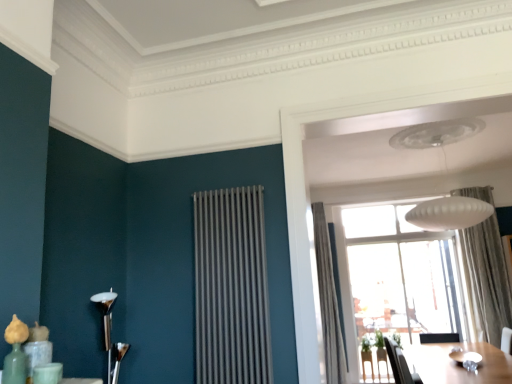
Where is `polished silver candlestick at left, the first lamp when ordered from bottom to top`? The width and height of the screenshot is (512, 384). polished silver candlestick at left, the first lamp when ordered from bottom to top is located at coordinates (110, 334).

What do you see at coordinates (110, 334) in the screenshot? I see `polished silver candlestick at left, the first lamp when ordered from bottom to top` at bounding box center [110, 334].

In order to face white matte lampshade at upper center, arranged as the second lamp when ordered from the bottom, should I rotate leftwards or rightwards?

To align with it, rotate right about 23.623°.

Describe the element at coordinates (231, 288) in the screenshot. I see `satin silver radiator at center` at that location.

The height and width of the screenshot is (384, 512). What do you see at coordinates (328, 301) in the screenshot?
I see `gray textured curtain at upper right, positioned as the 1th curtain in left-to-right order` at bounding box center [328, 301].

Looking at this image, what is the approximate width of gray textured curtain at upper right, positioned as the second curtain in right-to-left order?

gray textured curtain at upper right, positioned as the second curtain in right-to-left order, is 20.97 inches in width.

This screenshot has width=512, height=384. I want to click on polished silver candlestick at left, which is the 2th lamp in top-to-bottom order, so click(x=110, y=334).

Consider the image. Considering the relative sizes of white textured curtain at upper right, the first curtain positioned from the right, and transparent glass window at center in the image provided, is white textured curtain at upper right, the first curtain positioned from the right, thinner than transparent glass window at center?

No.

From the image's perspective, does white textured curtain at upper right, the first curtain positioned from the right, appear higher than transparent glass window at center?

Yes.

Is white textured curtain at upper right, arranged as the second curtain when viewed from the left, positioned far away from transparent glass window at center?

white textured curtain at upper right, arranged as the second curtain when viewed from the left, is actually quite close to transparent glass window at center.

How many degrees apart are the facing directions of white textured curtain at upper right, the first curtain positioned from the right, and transparent glass window at center?

The angle between the facing direction of white textured curtain at upper right, the first curtain positioned from the right, and the facing direction of transparent glass window at center is 4.69 degrees.

Considering the sizes of objects black leather swivel chair at lower right and satin silver radiator at center in the image provided, who is wider, black leather swivel chair at lower right or satin silver radiator at center?

black leather swivel chair at lower right.

Considering the relative sizes of black leather swivel chair at lower right and satin silver radiator at center in the image provided, is black leather swivel chair at lower right smaller than satin silver radiator at center?

Incorrect, black leather swivel chair at lower right is not smaller in size than satin silver radiator at center.

Would you say black leather swivel chair at lower right is a long distance from satin silver radiator at center?

black leather swivel chair at lower right is positioned a significant distance from satin silver radiator at center.

The image size is (512, 384). In order to click on lamp behind the polished silver candlestick at left, marked as the 1th lamp in a left-to-right arrangement in this screenshot , I will do `click(449, 213)`.

From the image's perspective, is white matte lampshade at upper center, the 1th lamp from the top, on top of polished silver candlestick at left, marked as the 1th lamp in a left-to-right arrangement?

Correct, white matte lampshade at upper center, the 1th lamp from the top, appears higher than polished silver candlestick at left, marked as the 1th lamp in a left-to-right arrangement, in the image.

Could you tell me if white matte lampshade at upper center, positioned as the first lamp in right-to-left order, is turned towards polished silver candlestick at left, acting as the second lamp starting from the back?

No, white matte lampshade at upper center, positioned as the first lamp in right-to-left order, is not oriented towards polished silver candlestick at left, acting as the second lamp starting from the back.

Which is behind, point (457, 208) or point (99, 305)?

The point (457, 208) is behind.

From the image's perspective, who appears lower, white textured curtain at upper right, the first curtain positioned from the right, or black leather swivel chair at lower right?

black leather swivel chair at lower right, from the image's perspective.

The height and width of the screenshot is (384, 512). What are the coordinates of `the 2nd curtain located above the black leather swivel chair at lower right (from a real-world perspective)` in the screenshot? It's located at (487, 277).

Can you tell me how much white textured curtain at upper right, arranged as the second curtain when viewed from the left, and black leather swivel chair at lower right differ in facing direction?

The angular difference between white textured curtain at upper right, arranged as the second curtain when viewed from the left, and black leather swivel chair at lower right is 95.1 degrees.

From the picture: Which is more to the left, white textured curtain at upper right, arranged as the second curtain when viewed from the left, or black leather swivel chair at lower right?

black leather swivel chair at lower right.

Between transparent glass window at center and white matte lampshade at upper center, the 1th lamp from the top, which one has smaller size?

white matte lampshade at upper center, the 1th lamp from the top.

From a real-world perspective, is transparent glass window at center physically below white matte lampshade at upper center, acting as the 1th lamp starting from the back?

Correct, in the physical world, transparent glass window at center is lower than white matte lampshade at upper center, acting as the 1th lamp starting from the back.

Visually, is transparent glass window at center positioned to the left or to the right of white matte lampshade at upper center, the 2th lamp in the front-to-back sequence?

Based on their positions, transparent glass window at center is located to the right of white matte lampshade at upper center, the 2th lamp in the front-to-back sequence.

From the image's perspective, which is below, transparent glass window at center or white matte lampshade at upper center, arranged as the second lamp when ordered from the bottom?

transparent glass window at center.

Considering the relative sizes of white matte lampshade at upper center, the 2th lamp in the front-to-back sequence, and black leather swivel chair at lower right in the image provided, is white matte lampshade at upper center, the 2th lamp in the front-to-back sequence, taller than black leather swivel chair at lower right?

Correct, white matte lampshade at upper center, the 2th lamp in the front-to-back sequence, is much taller as black leather swivel chair at lower right.

Is white matte lampshade at upper center, the 2th lamp in the front-to-back sequence, at the right side of black leather swivel chair at lower right?

Indeed, white matte lampshade at upper center, the 2th lamp in the front-to-back sequence, is positioned on the right side of black leather swivel chair at lower right.

Does white matte lampshade at upper center, acting as the 1th lamp starting from the back, have a smaller size compared to black leather swivel chair at lower right?

No.

Is white matte lampshade at upper center, arranged as the second lamp when ordered from the bottom, further to the viewer compared to black leather swivel chair at lower right?

No, the depth of white matte lampshade at upper center, arranged as the second lamp when ordered from the bottom, is less than that of black leather swivel chair at lower right.

From the image's perspective, is white matte lampshade at upper center, the 2th lamp in the front-to-back sequence, above satin silver radiator at center?

Yes.

In terms of height, does white matte lampshade at upper center, acting as the 2th lamp starting from the left, look taller or shorter compared to satin silver radiator at center?

Clearly, white matte lampshade at upper center, acting as the 2th lamp starting from the left, is shorter compared to satin silver radiator at center.

Is white matte lampshade at upper center, positioned as the first lamp in right-to-left order, oriented away from satin silver radiator at center?

No, satin silver radiator at center is not at the back of white matte lampshade at upper center, positioned as the first lamp in right-to-left order.

At what (x,y) coordinates should I click in order to perform the action: click on curtain that is the 2nd one when counting upward from the transparent glass window at center (from the image's perspective). Please return your answer as a coordinate pair (x, y). The image size is (512, 384). Looking at the image, I should click on (487, 277).

I want to click on swivel chair behind the satin silver radiator at center, so click(400, 365).

When comparing their distances from black leather swivel chair at lower right, does satin silver radiator at center or gray textured curtain at upper right, positioned as the second curtain in right-to-left order, seem closer?

gray textured curtain at upper right, positioned as the second curtain in right-to-left order, is closer to black leather swivel chair at lower right.

Estimate the real-world distances between objects in this image. Which object is closer to satin silver radiator at center, gray textured curtain at upper right, positioned as the 1th curtain in left-to-right order, or wooden table at lower right?

Based on the image, gray textured curtain at upper right, positioned as the 1th curtain in left-to-right order, appears to be nearer to satin silver radiator at center.

Which object lies further to the anchor point polished silver candlestick at left, the 2th lamp positioned from the right, satin silver radiator at center or white textured curtain at upper right, the first curtain positioned from the right?

Among the two, white textured curtain at upper right, the first curtain positioned from the right, is located further to polished silver candlestick at left, the 2th lamp positioned from the right.

In the scene shown: Based on their spatial positions, is wooden table at lower right or white matte lampshade at upper center, the 1th lamp from the top, further from polished silver candlestick at left, marked as the 1th lamp in a left-to-right arrangement?

Based on the image, white matte lampshade at upper center, the 1th lamp from the top, appears to be further to polished silver candlestick at left, marked as the 1th lamp in a left-to-right arrangement.

Looking at the image, which one is located closer to white textured curtain at upper right, arranged as the second curtain when viewed from the left, transparent glass window at center or satin silver radiator at center?

transparent glass window at center is closer to white textured curtain at upper right, arranged as the second curtain when viewed from the left.

Looking at the image, which one is located closer to polished silver candlestick at left, acting as the second lamp starting from the back, white textured curtain at upper right, the first curtain positioned from the right, or satin silver radiator at center?

satin silver radiator at center is positioned closer to the anchor polished silver candlestick at left, acting as the second lamp starting from the back.

Based on the photo, when comparing their distances from wooden table at lower right, does satin silver radiator at center or polished silver candlestick at left, which ranks as the first lamp in front-to-back order, seem closer?

The object closer to wooden table at lower right is satin silver radiator at center.

From the image, which object appears to be nearer to white matte lampshade at upper center, arranged as the second lamp when ordered from the bottom, white textured curtain at upper right, arranged as the second curtain when viewed from the left, or wooden table at lower right?

The object closer to white matte lampshade at upper center, arranged as the second lamp when ordered from the bottom, is white textured curtain at upper right, arranged as the second curtain when viewed from the left.

Where is `radiator between polished silver candlestick at left, marked as the 1th lamp in a left-to-right arrangement, and wooden table at lower right, in the horizontal direction`? This screenshot has width=512, height=384. radiator between polished silver candlestick at left, marked as the 1th lamp in a left-to-right arrangement, and wooden table at lower right, in the horizontal direction is located at coordinates (231, 288).

You are a GUI agent. You are given a task and a screenshot of the screen. Output one action in this format:
    pyautogui.click(x=<x>, y=<y>)
    Task: Click on the swivel chair situated between gray textured curtain at upper right, positioned as the 1th curtain in left-to-right order, and white textured curtain at upper right, the first curtain positioned from the right, from left to right
    
    Given the screenshot: What is the action you would take?
    pyautogui.click(x=400, y=365)

You are a GUI agent. You are given a task and a screenshot of the screen. Output one action in this format:
    pyautogui.click(x=<x>, y=<y>)
    Task: Click on the swivel chair between polished silver candlestick at left, which ranks as the first lamp in front-to-back order, and gray textured curtain at upper right, positioned as the second curtain in right-to-left order, along the z-axis
    The width and height of the screenshot is (512, 384).
    Given the screenshot: What is the action you would take?
    pyautogui.click(x=400, y=365)

This screenshot has width=512, height=384. Find the location of `radiator between polished silver candlestick at left, the 2th lamp positioned from the right, and white textured curtain at upper right, the first curtain positioned from the right, from left to right`. radiator between polished silver candlestick at left, the 2th lamp positioned from the right, and white textured curtain at upper right, the first curtain positioned from the right, from left to right is located at coordinates (231, 288).